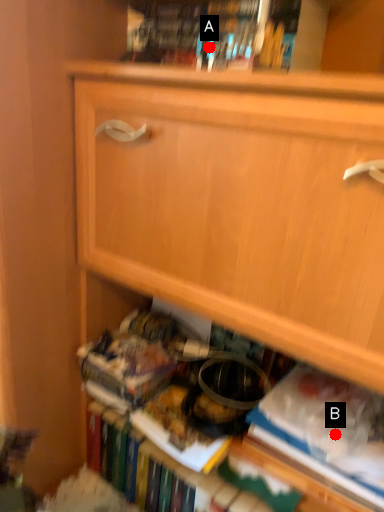
Question: Two points are circled on the image, labeled by A and B beside each circle. Which point appears farthest from the camera in this image?

Choices:
 (A) A is further
 (B) B is further

Answer: (B)